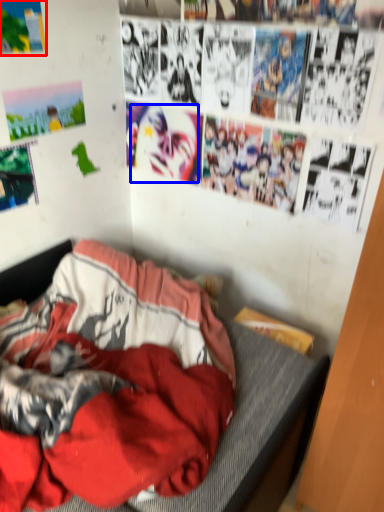
Question: Which point is further to the camera, poster page (highlighted by a red box) or person (highlighted by a blue box)?

Choices:
 (A) poster page
 (B) person

Answer: (B)